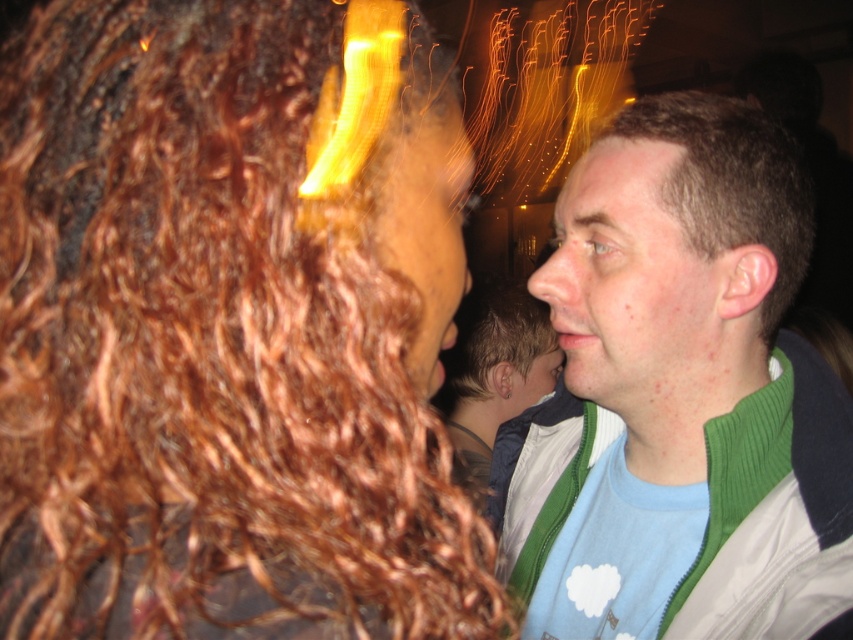
You are standing in front of the scene and want to locate the green corduroy jacket at right. According to the coordinates provided, where exactly is it positioned?

The green corduroy jacket at right is located at point (680,396).

You are a fashion designer observing the scene. You need to decide which item is taller between the green corduroy jacket at right and the light brown hair at center. Which one is taller?

The green corduroy jacket at right is taller than the light brown hair at center according to the description.

You are standing in front of the scene and want to touch the brown matte hair at right. What are the coordinates where you should aim your hand?

The coordinates for the brown matte hair at right are at point (732, 182).